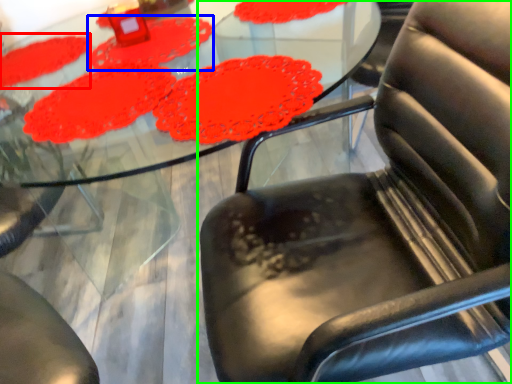
Question: Estimate the real-world distances between objects in this image. Which object is closer to mat (highlighted by a red box), mat (highlighted by a blue box) or chair (highlighted by a green box)?

Choices:
 (A) mat
 (B) chair

Answer: (A)